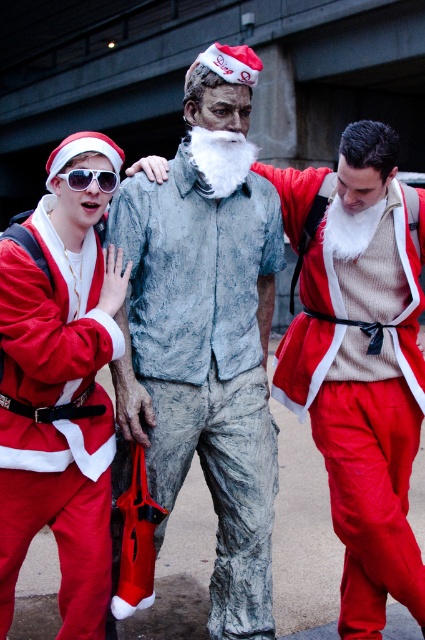
How much distance is there between matte red santa suit at center and fuzzy red santa suit at left?

matte red santa suit at center and fuzzy red santa suit at left are 3.36 feet apart.

Does matte red santa suit at center have a lesser height compared to fuzzy red santa suit at left?

No.

Who is more forward, (280, 394) or (107, 349)?

Positioned in front is point (107, 349).

Locate an element on the screen. matte red santa suit at center is located at coordinates (359, 362).

Can you confirm if matte red santa suit at center is positioned above white plastic sunglasses at upper left?

No.

Does matte red santa suit at center lie in front of white plastic sunglasses at upper left?

That is False.

I want to click on matte red santa suit at center, so click(x=359, y=362).

Can you confirm if fuzzy red santa suit at left is positioned below white plastic sunglasses at upper left?

Indeed, fuzzy red santa suit at left is positioned under white plastic sunglasses at upper left.

The width and height of the screenshot is (425, 640). I want to click on fuzzy red santa suit at left, so click(x=56, y=420).